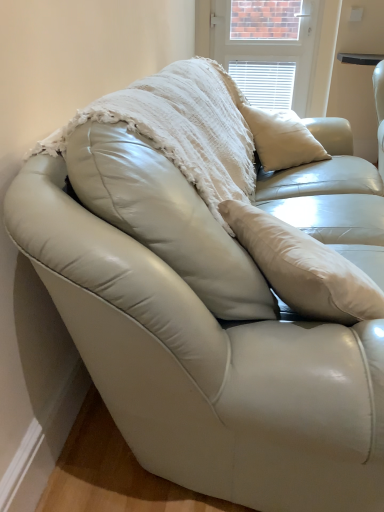
Image resolution: width=384 pixels, height=512 pixels. What do you see at coordinates (183, 128) in the screenshot? I see `white textured blanket at center` at bounding box center [183, 128].

Identify the location of white textured blinds at upper center. The width and height of the screenshot is (384, 512). (278, 51).

Is white textured blinds at upper center in contact with white leather table at upper right?

They are not placed beside each other.

Which object is positioned more to the left, white textured blinds at upper center or white leather table at upper right?

white textured blinds at upper center.

Can you tell me how much white textured blinds at upper center and white leather table at upper right differ in facing direction?

white textured blinds at upper center and white leather table at upper right are facing 0.097 degrees away from each other.

Between point (308, 109) and point (377, 61), which one is positioned in front?

The point (377, 61) is more forward.

Would you consider white leather table at upper right to be distant from white textured blinds at upper center?

That's not correct — white leather table at upper right is a little close to white textured blinds at upper center.

Which is correct: white leather table at upper right is inside white textured blinds at upper center, or outside of it?

white leather table at upper right exists outside the volume of white textured blinds at upper center.

This screenshot has width=384, height=512. I want to click on window screen above the white leather table at upper right (from a real-world perspective), so click(278, 51).

Which object is wider, white leather table at upper right or white textured blinds at upper center?

white leather table at upper right.

From the image's perspective, is white textured blanket at center located above or below white textured blinds at upper center?

From the image's perspective, white textured blanket at center appears below white textured blinds at upper center.

Does point (209, 160) come in front of point (225, 23)?

Yes.

Is white textured blanket at center thinner than white textured blinds at upper center?

No.

Is white textured blanket at center taller or shorter than white textured blinds at upper center?

Considering their sizes, white textured blanket at center has less height than white textured blinds at upper center.

Is point (325, 44) less distant than point (230, 76)?

That is True.

Is white textured blinds at upper center completely or partially outside of white textured blanket at center?

Absolutely, white textured blinds at upper center is external to white textured blanket at center.

From a real-world perspective, is white textured blinds at upper center under white textured blanket at center?

Correct, in the physical world, white textured blinds at upper center is lower than white textured blanket at center.

The width and height of the screenshot is (384, 512). What are the coordinates of `blanket below the white textured blinds at upper center (from the image's perspective)` in the screenshot? It's located at (183, 128).

Find the location of a particular element. This screenshot has height=512, width=384. blanket below the white leather table at upper right (from the image's perspective) is located at coordinates (183, 128).

Would you say white leather table at upper right contains white textured blanket at center?

No, white textured blanket at center is not surrounded by white leather table at upper right.

Which of these two, white leather table at upper right or white textured blanket at center, is bigger?

With larger size is white textured blanket at center.

Is white leather table at upper right taller or shorter than white textured blanket at center?

In the image, white leather table at upper right appears to be taller than white textured blanket at center.

What's the angular difference between white textured blanket at center and white leather table at upper right's facing directions?

white textured blanket at center and white leather table at upper right are facing 89.3 degrees away from each other.

Does point (54, 133) come in front of point (340, 57)?

That is True.

From the image's perspective, between white textured blanket at center and white leather table at upper right, who is located below?

From the image's view, white textured blanket at center is below.

Find the location of a particular element. table below the white textured blinds at upper center (from the image's perspective) is located at coordinates (359, 58).

Where is `window screen lying behind the white leather table at upper right`? window screen lying behind the white leather table at upper right is located at coordinates (278, 51).

When comparing their distances from white textured blanket at center, does white textured blinds at upper center or white leather table at upper right seem further?

Among the two, white leather table at upper right is located further to white textured blanket at center.

Looking at the image, which one is located closer to white textured blinds at upper center, white leather table at upper right or white textured blanket at center?

Based on the image, white leather table at upper right appears to be nearer to white textured blinds at upper center.

Which object lies further to the anchor point white leather table at upper right, white textured blanket at center or white textured blinds at upper center?

Among the two, white textured blanket at center is located further to white leather table at upper right.

From the image, which object appears to be farther from white textured blanket at center, white leather table at upper right or white textured blinds at upper center?

white leather table at upper right is further to white textured blanket at center.

Which object lies further to the anchor point white leather table at upper right, white textured blinds at upper center or white textured blanket at center?

white textured blanket at center.

Based on their spatial positions, is white textured blanket at center or white leather table at upper right closer to white textured blinds at upper center?

white leather table at upper right.

The width and height of the screenshot is (384, 512). I want to click on table between white textured blanket at center and white textured blinds at upper center in the front-back direction, so click(359, 58).